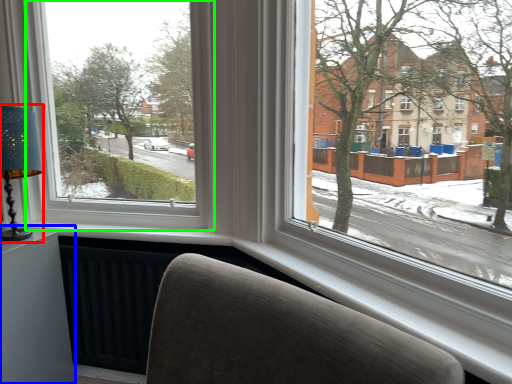
Question: Which object is positioned closest to table lamp (highlighted by a red box)? Select from table (highlighted by a blue box) and window (highlighted by a green box).

Choices:
 (A) table
 (B) window

Answer: (B)